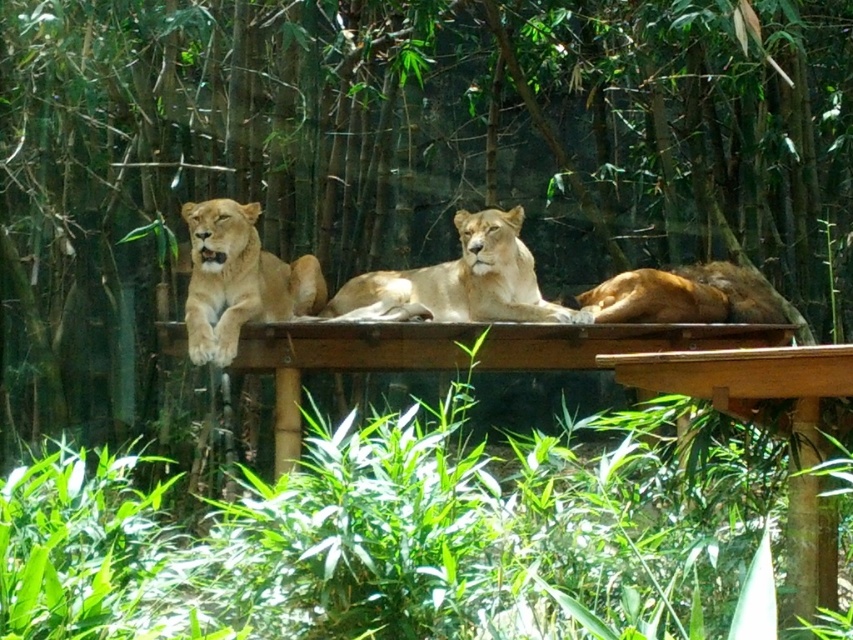
Does point (424, 276) lie behind point (659, 292)?

Yes, point (424, 276) is farther from viewer.

The image size is (853, 640). What do you see at coordinates (465, 278) in the screenshot?
I see `light brown fur lion at center` at bounding box center [465, 278].

This screenshot has height=640, width=853. What do you see at coordinates (465, 278) in the screenshot? I see `light brown fur lion at center` at bounding box center [465, 278].

Locate an element on the screen. The width and height of the screenshot is (853, 640). light brown fur lion at center is located at coordinates (465, 278).

Can you confirm if golden fur lion at upper center is bigger than golden fur lion at center?

Yes, golden fur lion at upper center is bigger than golden fur lion at center.

Between golden fur lion at upper center and golden fur lion at center, which one has less height?

With less height is golden fur lion at center.

I want to click on golden fur lion at upper center, so click(239, 280).

Is golden fur lion at upper center wider than light brown fur lion at center?

No, golden fur lion at upper center is not wider than light brown fur lion at center.

Where is `golden fur lion at upper center`? The height and width of the screenshot is (640, 853). golden fur lion at upper center is located at coordinates (239, 280).